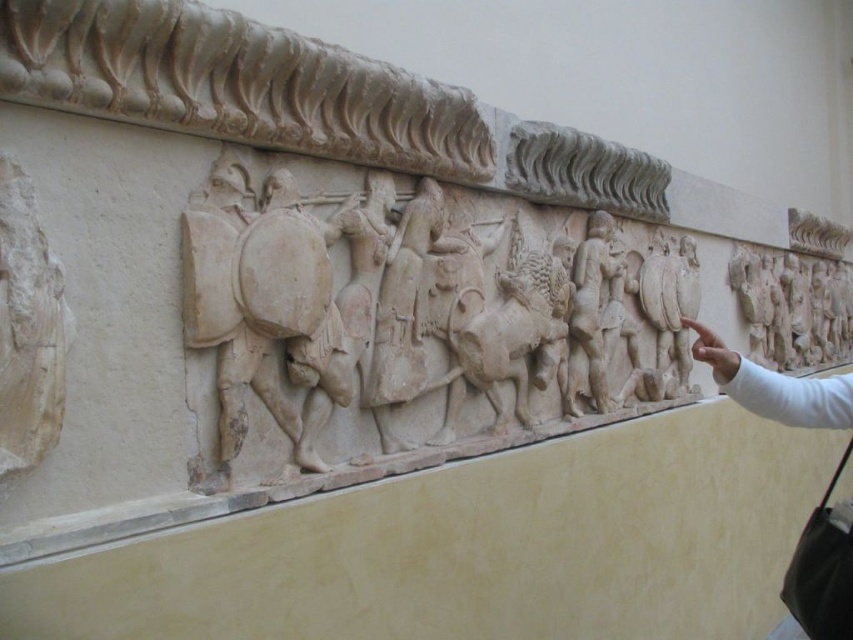
Question: Can you confirm if white stone relief at center is positioned above white stone warrior at center?

Choices:
 (A) yes
 (B) no

Answer: (B)

Question: Which object appears closest to the camera in this image?

Choices:
 (A) white stone relief at upper right
 (B) white stone warrior at center
 (C) white stone relief at center

Answer: (C)

Question: Can you confirm if white stone relief at center is positioned to the left of white stone relief at upper right?

Choices:
 (A) no
 (B) yes

Answer: (B)

Question: Which point appears closest to the camera in this image?

Choices:
 (A) pos(453,342)
 (B) pos(578,310)

Answer: (A)

Question: Does white stone relief at upper right have a larger size compared to white stone warrior at center?

Choices:
 (A) yes
 (B) no

Answer: (A)

Question: Which of the following is the farthest from the observer?

Choices:
 (A) (590, 314)
 (B) (804, 275)
 (C) (512, 227)

Answer: (B)